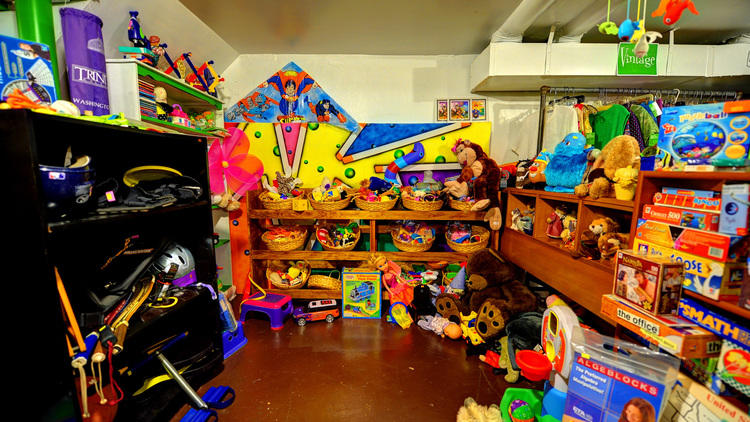
Identify the location of hanging stuffed animals. (661, 5), (644, 41), (625, 30), (610, 31), (164, 169).